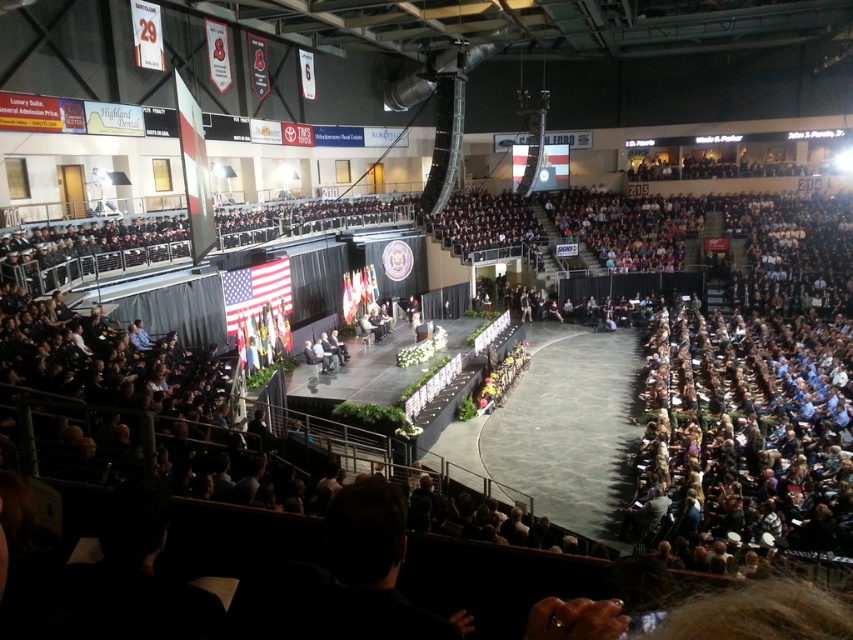
You are a photographer at the event and need to capture a photo of both the matte american flag at center and the silk american flag at center stage. From the audience perspective, which flag is positioned to the left?

The matte american flag at center is positioned to the left of the silk american flag at center stage.

You are an event organizer checking the stage setup. You notice two American flags on the stage. Which one is taller, the matte American flag at center or the silk American flag at center stage?

The matte American flag at center is taller than the silk American flag at center stage.